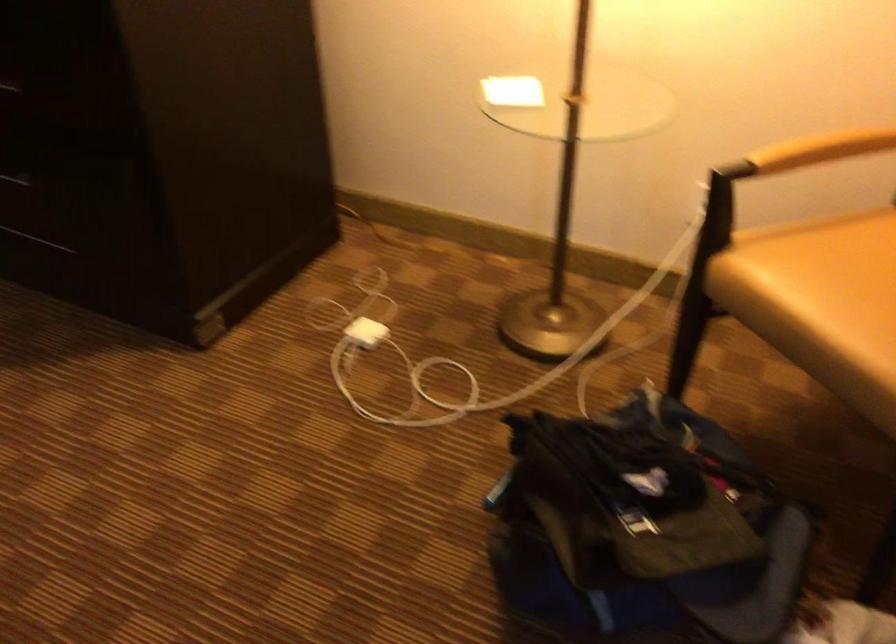
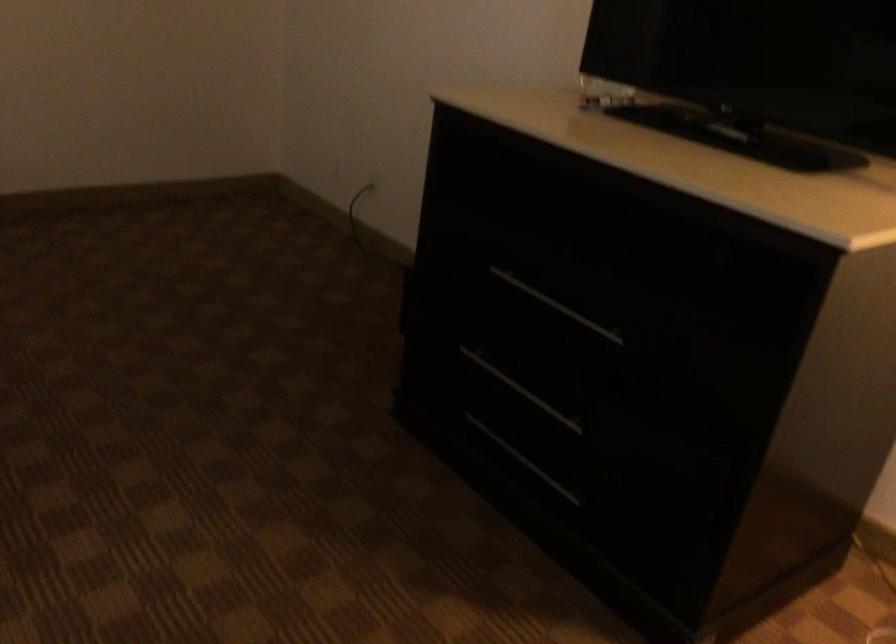
Question: The first image is from the beginning of the video and the second image is from the end. How did the camera likely rotate when shooting the video?

Choices:
 (A) Left
 (B) Right
 (C) Up
 (D) Down

Answer: (A)